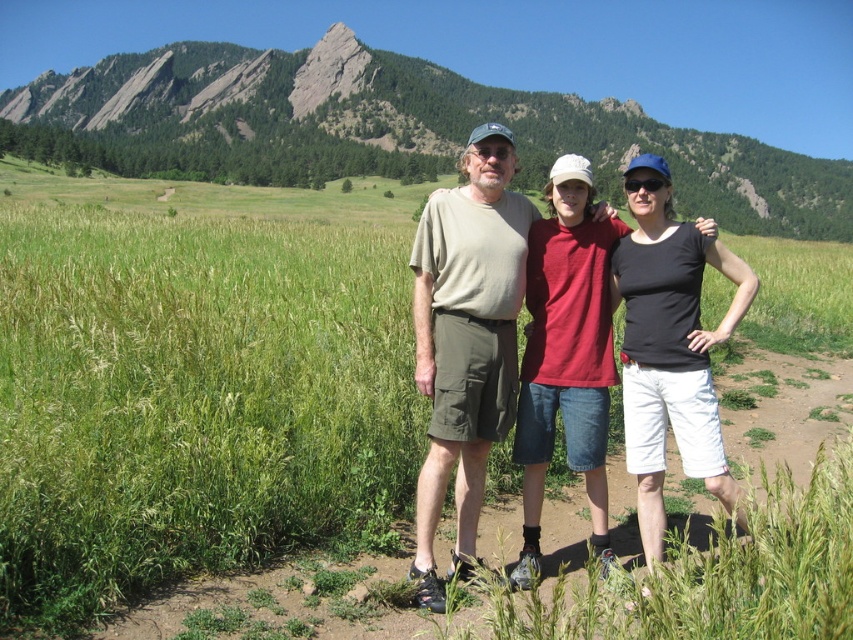
Looking at this image, you are a photographer trying to capture the matte khaki shorts at center in your shot. Based on the coordinates provided, where should you position your camera relative to the central point of the image?

The matte khaki shorts at center are located at point coordinates of (467, 337). Since the central point of the image is typically at (426, 320), the shorts are slightly to the right and above the center. To capture them, position your camera slightly to the right and upward from the central point.

You are standing at the point with coordinates point (x=581, y=182) and want to walk towards the point with coordinates point (x=479, y=212). Will you be moving forward or backward in relation to the scene?

Since point (x=479, y=212) is behind point (x=581, y=182), moving towards it would mean moving backward in relation to the scene.